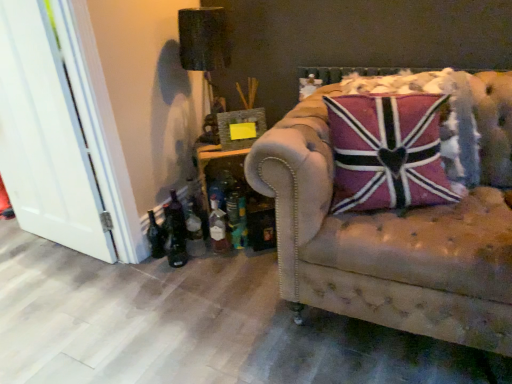
Find the location of a particular element. Image resolution: width=512 pixels, height=384 pixels. vacant space that's between translucent glass bottle at lower left, marked as the 2th bottle in a right-to-left arrangement, and translucent glass bottle at lower left, acting as the 3th bottle starting from the left is located at coordinates (214, 251).